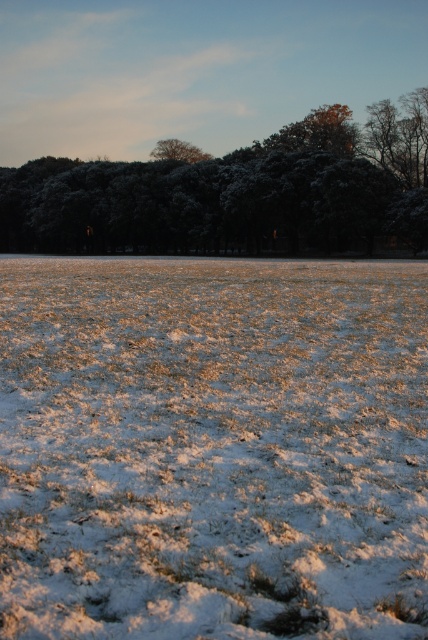
Does snow-covered trees at upper center appear over snow-covered tree at upper center?

Actually, snow-covered trees at upper center is below snow-covered tree at upper center.

Does point (62, 161) come closer to viewer compared to point (211, 157)?

No.

Where is `snow-covered trees at upper center`? snow-covered trees at upper center is located at coordinates (237, 193).